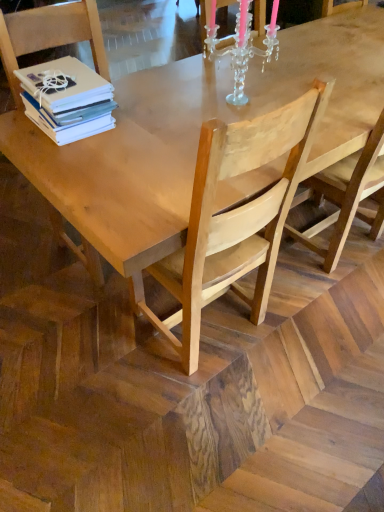
Where is `vacant space to the left of light brown wood chair at left, which ranks as the 2th chair in right-to-left order`? The height and width of the screenshot is (512, 384). vacant space to the left of light brown wood chair at left, which ranks as the 2th chair in right-to-left order is located at coordinates (33, 264).